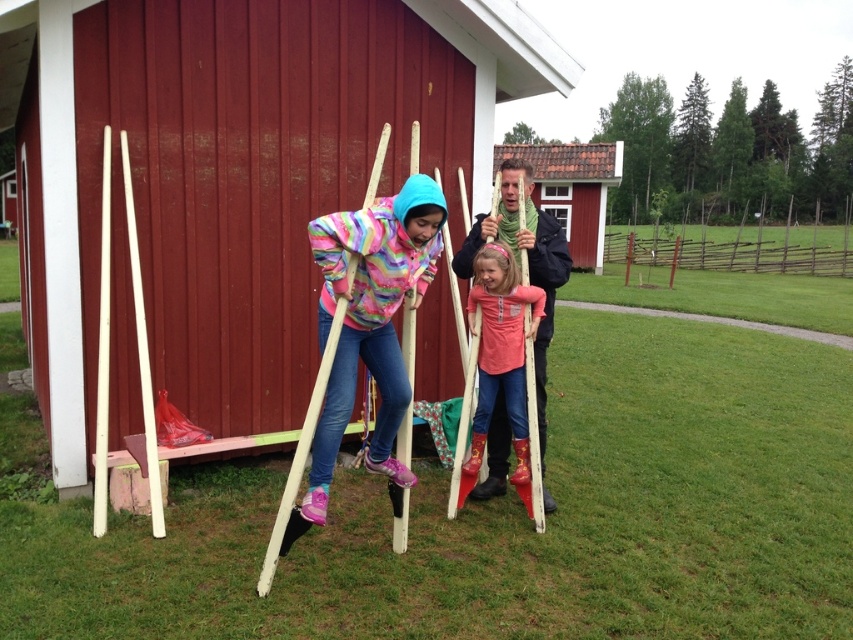
Question: Which object appears closest to the camera in this image?

Choices:
 (A) rainbow fleece jacket at center
 (B) matte pink sweater at center
 (C) brown tiled roof at upper center
 (D) smooth wooden sticks at center

Answer: (A)

Question: Which point is closer to the camera?

Choices:
 (A) matte pink sweater at center
 (B) smooth wooden sticks at center
 (C) brown tiled roof at upper center

Answer: (B)

Question: Which point is farther from the camera taking this photo?

Choices:
 (A) (250, 394)
 (B) (524, 241)
 (C) (383, 428)

Answer: (A)

Question: Is smooth wooden sticks at center to the right of rainbow fleece jacket at center from the viewer's perspective?

Choices:
 (A) no
 (B) yes

Answer: (A)

Question: Considering the relative positions of smooth wooden sticks at center and brown tiled roof at upper center in the image provided, where is smooth wooden sticks at center located with respect to brown tiled roof at upper center?

Choices:
 (A) left
 (B) right

Answer: (A)

Question: Where is matte pink sweater at center located in relation to brown tiled roof at upper center in the image?

Choices:
 (A) above
 (B) below

Answer: (B)